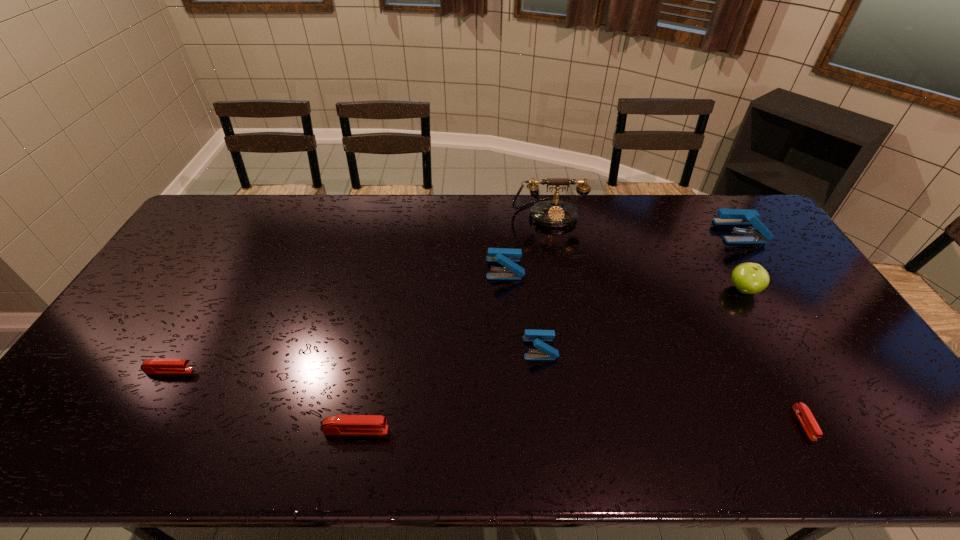
Where is `the tallest object`? the tallest object is located at coordinates (555, 213).

I want to click on telephone, so click(555, 213).

Find the location of a particular element. the farthest stapler is located at coordinates (726, 216).

The height and width of the screenshot is (540, 960). What are the coordinates of `the rightmost stapler` in the screenshot? It's located at (726, 216).

Find the location of a particular element. This screenshot has width=960, height=540. apple is located at coordinates (749, 278).

Find the location of `the fifth nearest stapler`. the fifth nearest stapler is located at coordinates (506, 257).

The width and height of the screenshot is (960, 540). What are the coordinates of `the second farthest blue stapler` in the screenshot? It's located at [506, 257].

The image size is (960, 540). Identify the location of the fourth shortest stapler. click(x=538, y=337).

The height and width of the screenshot is (540, 960). Identify the location of the fourth nearest stapler. (538, 337).

Identify the location of the fifth stapler from right to left. (339, 424).